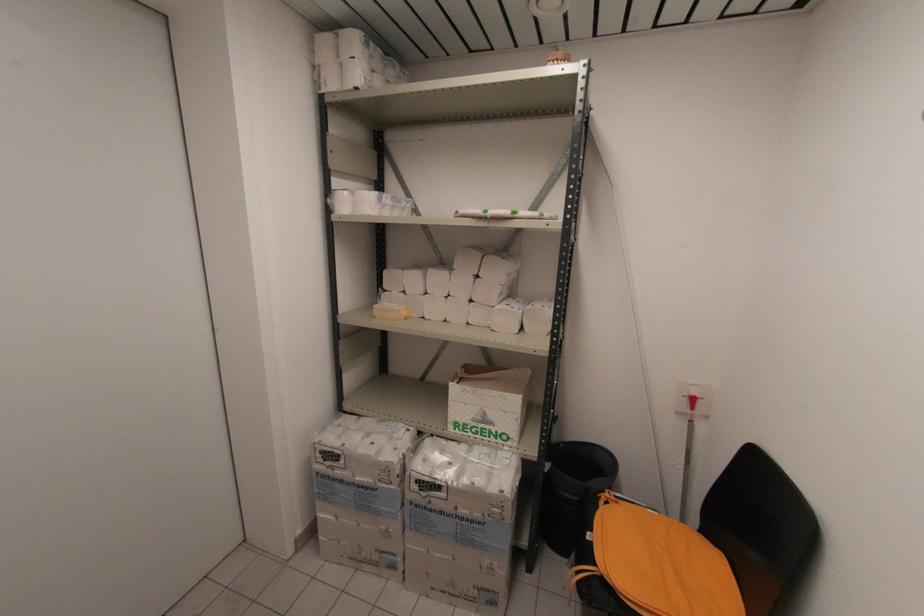
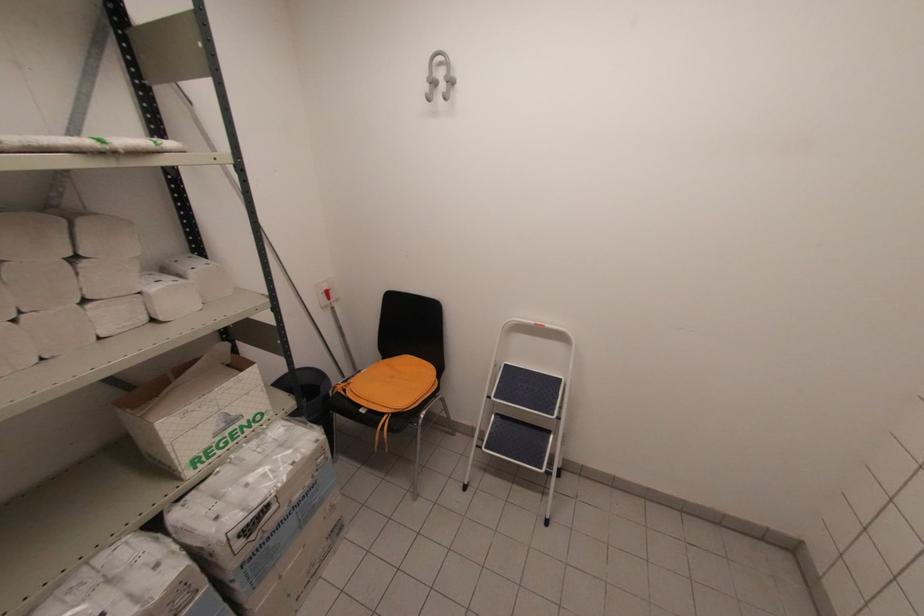
Where in the second image is the point corresponding to point 477,274 from the first image?

(71, 254)